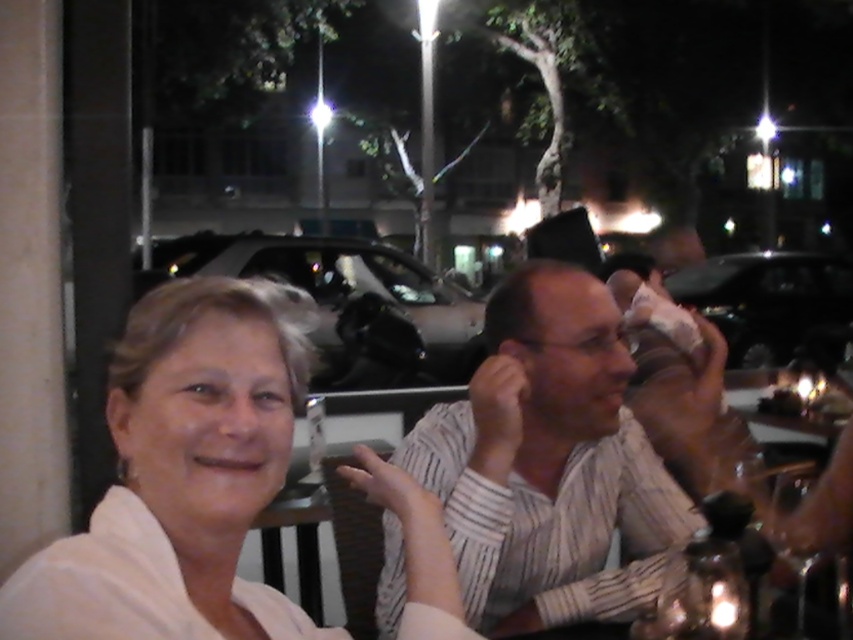
Question: Can you confirm if white matte shirt at center is positioned to the left of striped shirt at center?

Choices:
 (A) yes
 (B) no

Answer: (A)

Question: Can you confirm if white matte shirt at center is smaller than striped shirt at center?

Choices:
 (A) no
 (B) yes

Answer: (B)

Question: Which of the following is the farthest from the observer?

Choices:
 (A) (596, 372)
 (B) (135, 556)

Answer: (A)

Question: Can you confirm if white matte shirt at center is positioned below striped shirt at center?

Choices:
 (A) yes
 (B) no

Answer: (B)

Question: Among these points, which one is nearest to the camera?

Choices:
 (A) (146, 552)
 (B) (498, 428)

Answer: (A)